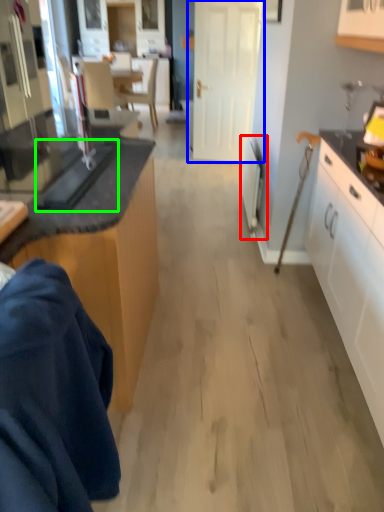
Question: Which is farther away from appliance (highlighted by a red box)? door (highlighted by a blue box) or appliance (highlighted by a green box)?

Choices:
 (A) door
 (B) appliance

Answer: (A)